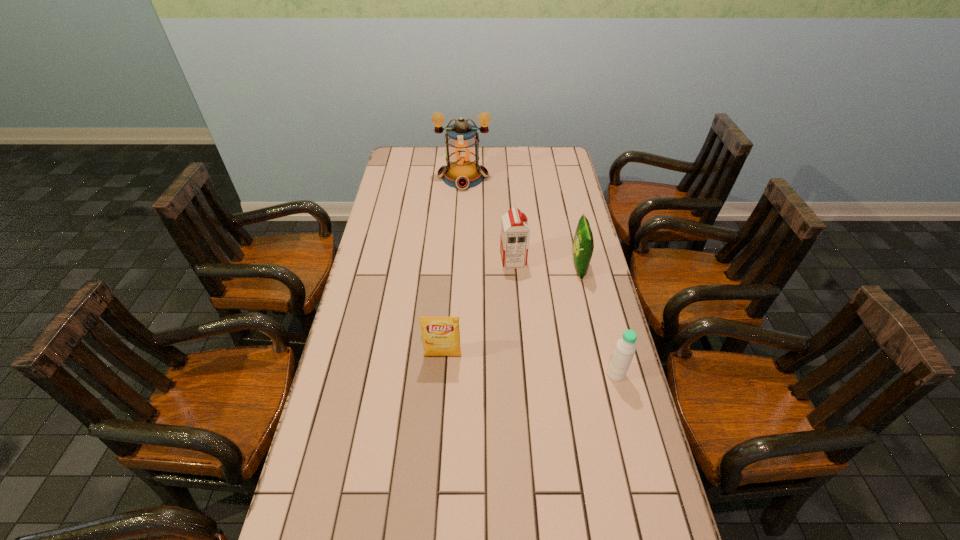
Identify which object is the closest to the farthest object. Please provide its 2D coordinates. Your answer should be formatted as a tuple, i.e. [(x, y)], where the tuple contains the x and y coordinates of a point satisfying the conditions above.

[(515, 232)]

This screenshot has height=540, width=960. Find the location of `object that can be found as the second closest to the nearest object`. object that can be found as the second closest to the nearest object is located at coordinates (441, 335).

What are the coordinates of `vacant space that satisfies the following two spatial constraints: 1. on the front-facing side of the soya milk; 2. on the right side of the farthest object` in the screenshot? It's located at (459, 260).

Find the location of a particular element. free space that satisfies the following two spatial constraints: 1. on the front-facing side of the farthest object; 2. on the left side of the water bottle is located at coordinates (453, 374).

You are a GUI agent. You are given a task and a screenshot of the screen. Output one action in this format:
    pyautogui.click(x=<x>, y=<y>)
    Task: Click on the free location that satisfies the following two spatial constraints: 1. on the front-facing side of the right crisp (potato chip); 2. on the front of the left crisp (potato chip) with the logo
    The image size is (960, 540).
    Given the screenshot: What is the action you would take?
    pyautogui.click(x=599, y=356)

The height and width of the screenshot is (540, 960). Identify the location of vacant area in the image that satisfies the following two spatial constraints: 1. on the front-facing side of the water bottle; 2. on the right side of the right crisp (potato chip). (604, 374).

Find the location of a particular element. The width and height of the screenshot is (960, 540). vacant region that satisfies the following two spatial constraints: 1. on the front-facing side of the nearest object; 2. on the right side of the farthest object is located at coordinates [x=453, y=374].